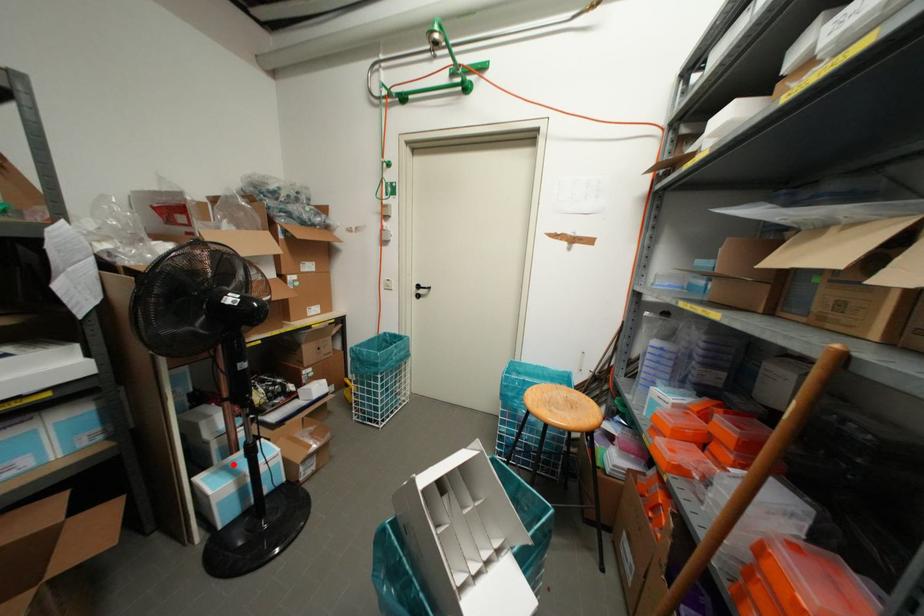
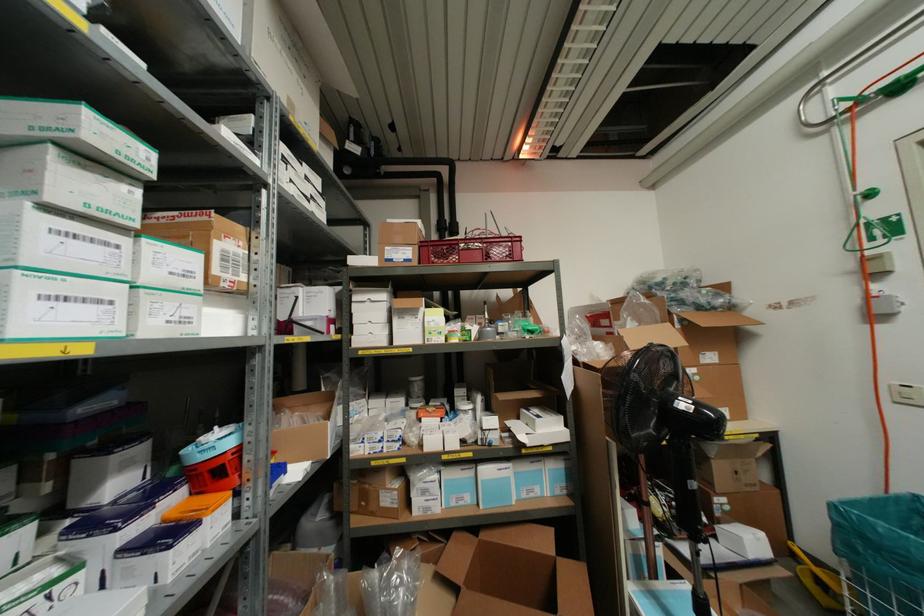
Find the pixel in the second image that matches the highlighted location in the first image.

(663, 601)